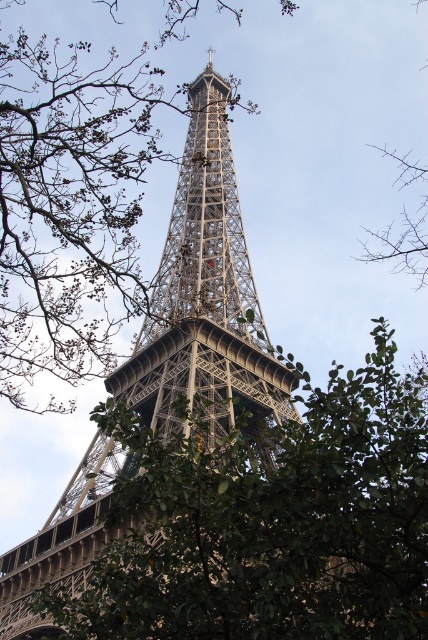
Between point (148, 522) and point (154, 390), which one is positioned behind?

The point (154, 390) is behind.

Which of these two, green leafy tree at center or metallic lattice tower at center, stands taller?

With more height is metallic lattice tower at center.

Where is `green leafy tree at center`? This screenshot has height=640, width=428. green leafy tree at center is located at coordinates (269, 520).

Who is shorter, green leafy tree at center or bare branches at upper right?

green leafy tree at center

Looking at this image, does green leafy tree at center have a greater height compared to bare branches at upper right?

Incorrect, green leafy tree at center's height is not larger of bare branches at upper right's.

Does point (116, 566) lie in front of point (422, 243)?

Yes, it is in front of point (422, 243).

You are a GUI agent. You are given a task and a screenshot of the screen. Output one action in this format:
    pyautogui.click(x=<x>, y=<y>)
    Task: Click on the green leafy tree at center
    
    Given the screenshot: What is the action you would take?
    pyautogui.click(x=269, y=520)

This screenshot has width=428, height=640. I want to click on metallic lattice tower at center, so click(x=205, y=292).

Who is higher up, metallic lattice tower at center or bare branches at upper right?

bare branches at upper right

Between point (14, 580) and point (422, 257), which one is positioned behind?

Point (422, 257)

The image size is (428, 640). I want to click on metallic lattice tower at center, so click(205, 292).